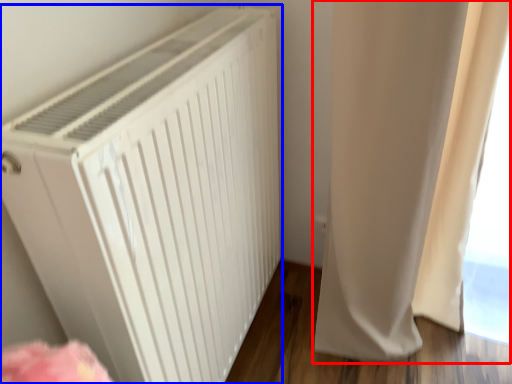
Question: Which object appears closest to the camera in this image, curtain (highlighted by a red box) or home appliance (highlighted by a blue box)?

Choices:
 (A) curtain
 (B) home appliance

Answer: (B)